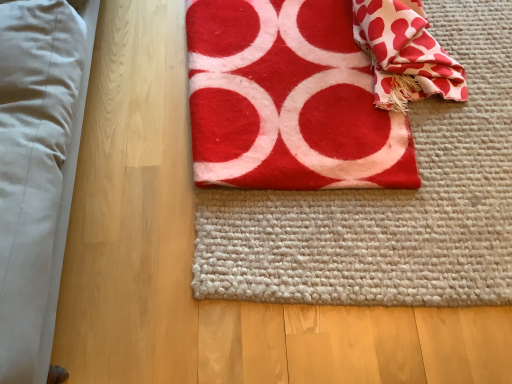
Image resolution: width=512 pixels, height=384 pixels. Describe the element at coordinates (289, 100) in the screenshot. I see `red felt towel at center` at that location.

I want to click on red felt yoga mat at center, so [x=347, y=160].

Image resolution: width=512 pixels, height=384 pixels. I want to click on white textured fabric at upper right, so click(x=405, y=54).

Does red felt yoga mat at center touch red felt towel at center?

Yes, red felt yoga mat at center is touching red felt towel at center.

This screenshot has width=512, height=384. What are the coordinates of `towel above the red felt yoga mat at center (from a real-world perspective)` in the screenshot? It's located at (289, 100).

How far apart are red felt yoga mat at center and red felt towel at center?

A distance of 2.69 inches exists between red felt yoga mat at center and red felt towel at center.

Can you tell me how much red felt yoga mat at center and red felt towel at center differ in facing direction?

179 degrees separate the facing orientations of red felt yoga mat at center and red felt towel at center.

Does white textured fabric at upper right have a lesser width compared to red felt towel at center?

Yes.

Can you confirm if white textured fabric at upper right is shorter than red felt towel at center?

Incorrect, the height of white textured fabric at upper right does not fall short of that of red felt towel at center.

From the image's perspective, relative to red felt towel at center, is white textured fabric at upper right above or below?

Based on their image positions, white textured fabric at upper right is located above red felt towel at center.

Image resolution: width=512 pixels, height=384 pixels. I want to click on towel on the left of white textured fabric at upper right, so click(x=289, y=100).

Does point (428, 89) appear closer or farther from the camera than point (497, 33)?

Point (428, 89) appears to be closer to the viewer than point (497, 33).

Is white textured fabric at upper right not near red felt yoga mat at center?

No, there isn't a large distance between white textured fabric at upper right and red felt yoga mat at center.

Is white textured fabric at upper right wider or thinner than red felt yoga mat at center?

Considering their sizes, white textured fabric at upper right looks slimmer than red felt yoga mat at center.

From the image's perspective, is red felt yoga mat at center located above white textured fabric at upper right?

No.

What's the angular difference between red felt yoga mat at center and white textured fabric at upper right's facing directions?

174 degrees.

Considering the relative positions of red felt yoga mat at center and white textured fabric at upper right in the image provided, is red felt yoga mat at center to the left of white textured fabric at upper right from the viewer's perspective?

Yes.

Considering the sizes of objects red felt yoga mat at center and white textured fabric at upper right in the image provided, who is wider, red felt yoga mat at center or white textured fabric at upper right?

With larger width is red felt yoga mat at center.

Find the location of a particular element. blanket located above the red felt towel at center (from a real-world perspective) is located at coordinates (405, 54).

From the image's perspective, which object appears higher, red felt towel at center or white textured fabric at upper right?

From the image's view, white textured fabric at upper right is above.

Considering the relative sizes of red felt towel at center and white textured fabric at upper right in the image provided, is red felt towel at center taller than white textured fabric at upper right?

In fact, red felt towel at center may be shorter than white textured fabric at upper right.

How different are the orientations of red felt towel at center and red felt yoga mat at center in degrees?

The facing directions of red felt towel at center and red felt yoga mat at center are 179 degrees apart.

Is red felt towel at center far from red felt yoga mat at center?

They are positioned close to each other.

Which is correct: red felt towel at center is inside red felt yoga mat at center, or outside of it?

red felt towel at center is not inside red felt yoga mat at center, it's outside.

Which is behind, point (364, 55) or point (439, 287)?

The point (364, 55) is behind.

Where is `towel located on the left of red felt yoga mat at center`? The width and height of the screenshot is (512, 384). towel located on the left of red felt yoga mat at center is located at coordinates (289, 100).

This screenshot has height=384, width=512. Find the location of `towel directly beneath the white textured fabric at upper right (from a real-world perspective)`. towel directly beneath the white textured fabric at upper right (from a real-world perspective) is located at coordinates (289, 100).

When comparing their distances from white textured fabric at upper right, does red felt towel at center or red felt yoga mat at center seem further?

Based on the image, red felt yoga mat at center appears to be further to white textured fabric at upper right.

Looking at the image, which one is located closer to red felt towel at center, white textured fabric at upper right or red felt yoga mat at center?

red felt yoga mat at center lies closer to red felt towel at center than the other object.

From the picture: Which object lies nearer to the anchor point red felt yoga mat at center, red felt towel at center or white textured fabric at upper right?

red felt towel at center lies closer to red felt yoga mat at center than the other object.

Looking at the image, which one is located closer to white textured fabric at upper right, red felt yoga mat at center or red felt towel at center?

red felt towel at center.

When comparing their distances from red felt towel at center, does red felt yoga mat at center or white textured fabric at upper right seem further?

white textured fabric at upper right lies further to red felt towel at center than the other object.

Considering their positions, is white textured fabric at upper right positioned further to red felt yoga mat at center than red felt towel at center?

white textured fabric at upper right is further to red felt yoga mat at center.

The height and width of the screenshot is (384, 512). Identify the location of yoga mat situated between red felt towel at center and white textured fabric at upper right from left to right. (347, 160).